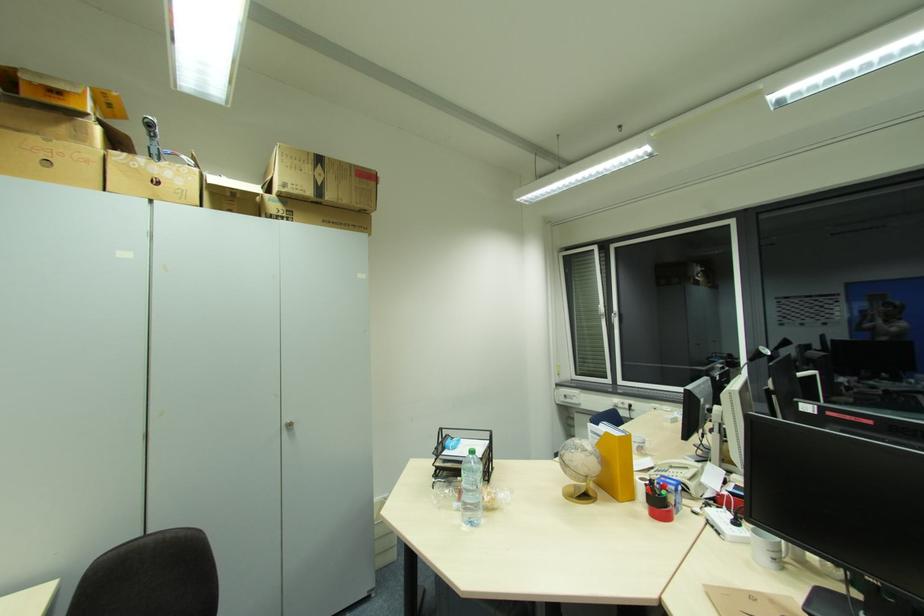
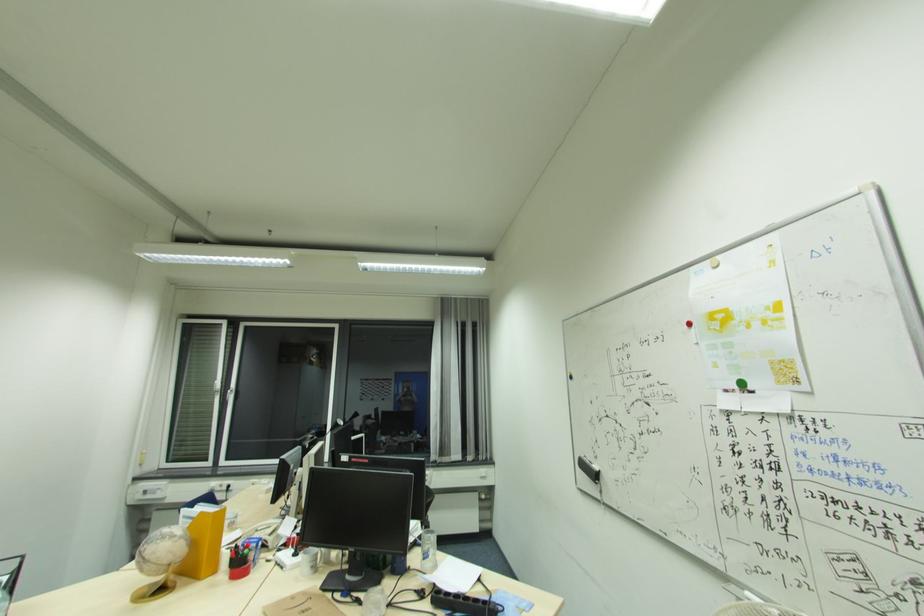
Find the pixel in the second image that matches [604,435] in the first image.

(198, 517)